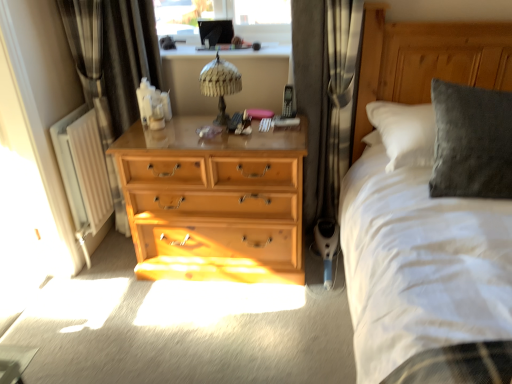
Image resolution: width=512 pixels, height=384 pixels. Describe the element at coordinates (323, 94) in the screenshot. I see `dark grey fabric curtain at center, marked as the 2th curtain in a left-to-right arrangement` at that location.

At what (x,y) coordinates should I click in order to perform the action: click on dark grey fabric curtain at center, marked as the 2th curtain in a left-to-right arrangement. Please return your answer as a coordinate pair (x, y). Looking at the image, I should click on (323, 94).

I want to click on black fabric curtain at left, which is the 2th curtain in right-to-left order, so click(112, 56).

You are a GUI agent. You are given a task and a screenshot of the screen. Output one action in this format:
    pyautogui.click(x=<x>, y=<y>)
    Task: Click on the woven fabric table lamp at center
    This screenshot has height=384, width=512.
    Given the screenshot: What is the action you would take?
    pyautogui.click(x=220, y=84)

You are a GUI agent. You are given a task and a screenshot of the screen. Output one action in this format:
    pyautogui.click(x=<x>, y=<y>)
    Task: Click on the radiator below the black fabric curtain at left, which is the 2th curtain in right-to-left order (from a real-world perspective)
    
    Given the screenshot: What is the action you would take?
    pyautogui.click(x=83, y=169)

Which is less distant, [78,12] or [58,145]?

The point [78,12] is closer to the camera.

Does black fabric curtain at left, placed as the first curtain when sorted from left to right, come behind white painted metal radiator at left?

No.

Who is taller, black fabric curtain at left, placed as the first curtain when sorted from left to right, or light wood dresser at center?

With more height is black fabric curtain at left, placed as the first curtain when sorted from left to right.

Which object is positioned more to the left, black fabric curtain at left, which is the 2th curtain in right-to-left order, or light wood dresser at center?

Positioned to the left is black fabric curtain at left, which is the 2th curtain in right-to-left order.

This screenshot has width=512, height=384. Identify the location of curtain that is the 2nd one above the light wood dresser at center (from a real-world perspective). (112, 56).

Based on their sizes in the image, would you say black fabric curtain at left, placed as the first curtain when sorted from left to right, is bigger or smaller than light wood dresser at center?

Clearly, black fabric curtain at left, placed as the first curtain when sorted from left to right, is smaller in size than light wood dresser at center.

Which of these two, woven fabric table lamp at center or light wood dresser at center, stands shorter?

woven fabric table lamp at center.

Which point is more distant from viewer, (209,68) or (270,191)?

The point (209,68) is farther.

This screenshot has height=384, width=512. What are the coordinates of `chest of drawers that appears on the left of woven fabric table lamp at center` in the screenshot? It's located at (213, 202).

From a real-world perspective, which is physically above, woven fabric table lamp at center or light wood dresser at center?

In real-world perspective, woven fabric table lamp at center is above.

Is black fabric curtain at left, which is the 2th curtain in right-to-left order, inside dark grey fabric curtain at center, marked as the 2th curtain in a left-to-right arrangement?

No, black fabric curtain at left, which is the 2th curtain in right-to-left order, is not inside dark grey fabric curtain at center, marked as the 2th curtain in a left-to-right arrangement.

Is dark grey fabric curtain at center, placed as the first curtain when sorted from right to left, positioned with its back to black fabric curtain at left, which is the 2th curtain in right-to-left order?

No, black fabric curtain at left, which is the 2th curtain in right-to-left order, is not at the back of dark grey fabric curtain at center, placed as the first curtain when sorted from right to left.

Can you confirm if dark grey fabric curtain at center, marked as the 2th curtain in a left-to-right arrangement, is wider than black fabric curtain at left, placed as the first curtain when sorted from left to right?

Yes, dark grey fabric curtain at center, marked as the 2th curtain in a left-to-right arrangement, is wider than black fabric curtain at left, placed as the first curtain when sorted from left to right.

Looking at this image, from the image's perspective, between light wood dresser at center and woven fabric table lamp at center, which one is located above?

woven fabric table lamp at center is shown above in the image.

What's the angular difference between light wood dresser at center and woven fabric table lamp at center's facing directions?

light wood dresser at center and woven fabric table lamp at center are facing 2.79 degrees away from each other.

From their relative heights in the image, would you say light wood dresser at center is taller or shorter than woven fabric table lamp at center?

light wood dresser at center is taller than woven fabric table lamp at center.

Where is `radiator on the left of dark grey fabric curtain at center, placed as the first curtain when sorted from right to left`? The image size is (512, 384). radiator on the left of dark grey fabric curtain at center, placed as the first curtain when sorted from right to left is located at coordinates (83, 169).

Is dark grey fabric curtain at center, placed as the first curtain when sorted from right to left, looking in the opposite direction of white painted metal radiator at left?

dark grey fabric curtain at center, placed as the first curtain when sorted from right to left, is not turned away from white painted metal radiator at left.

How different are the orientations of dark grey fabric curtain at center, placed as the first curtain when sorted from right to left, and white painted metal radiator at left in degrees?

There is a 88.6-degree angle between the facing directions of dark grey fabric curtain at center, placed as the first curtain when sorted from right to left, and white painted metal radiator at left.

Looking at this image, can you confirm if dark grey fabric curtain at center, placed as the first curtain when sorted from right to left, is thinner than white painted metal radiator at left?

No, dark grey fabric curtain at center, placed as the first curtain when sorted from right to left, is not thinner than white painted metal radiator at left.

Which of these two, black fabric curtain at left, placed as the first curtain when sorted from left to right, or woven fabric table lamp at center, is thinner?

black fabric curtain at left, placed as the first curtain when sorted from left to right.

Between black fabric curtain at left, placed as the first curtain when sorted from left to right, and woven fabric table lamp at center, which one has less height?

With less height is woven fabric table lamp at center.

Does black fabric curtain at left, which is the 2th curtain in right-to-left order, have a smaller size compared to woven fabric table lamp at center?

Incorrect, black fabric curtain at left, which is the 2th curtain in right-to-left order, is not smaller in size than woven fabric table lamp at center.

Is point (74, 4) closer or farther from the camera than point (222, 125)?

Clearly, point (74, 4) is more distant from the camera than point (222, 125).

There is a white painted metal radiator at left. In order to click on the 1st curtain above it (from the image's perspective) in this screenshot , I will do `click(112, 56)`.

I want to click on curtain that is the 2nd one when counting backward from the light wood dresser at center, so click(x=112, y=56).

When comparing their distances from white painted metal radiator at left, does black fabric curtain at left, which is the 2th curtain in right-to-left order, or light wood dresser at center seem closer?

The object closer to white painted metal radiator at left is black fabric curtain at left, which is the 2th curtain in right-to-left order.

Estimate the real-world distances between objects in this image. Which object is further from dark grey fabric curtain at center, placed as the first curtain when sorted from right to left, light wood dresser at center or black fabric curtain at left, which is the 2th curtain in right-to-left order?

black fabric curtain at left, which is the 2th curtain in right-to-left order, is positioned further to the anchor dark grey fabric curtain at center, placed as the first curtain when sorted from right to left.

When comparing their distances from woven fabric table lamp at center, does light wood dresser at center or black fabric curtain at left, placed as the first curtain when sorted from left to right, seem closer?

light wood dresser at center is positioned closer to the anchor woven fabric table lamp at center.

When comparing their distances from dark grey fabric curtain at center, marked as the 2th curtain in a left-to-right arrangement, does woven fabric table lamp at center or light wood dresser at center seem closer?

woven fabric table lamp at center is positioned closer to the anchor dark grey fabric curtain at center, marked as the 2th curtain in a left-to-right arrangement.

From the image, which object appears to be nearer to woven fabric table lamp at center, dark grey fabric curtain at center, marked as the 2th curtain in a left-to-right arrangement, or white painted metal radiator at left?

dark grey fabric curtain at center, marked as the 2th curtain in a left-to-right arrangement.

Which object lies further to the anchor point black fabric curtain at left, which is the 2th curtain in right-to-left order, dark grey fabric curtain at center, placed as the first curtain when sorted from right to left, or light wood dresser at center?

Among the two, dark grey fabric curtain at center, placed as the first curtain when sorted from right to left, is located further to black fabric curtain at left, which is the 2th curtain in right-to-left order.

Considering their positions, is black fabric curtain at left, which is the 2th curtain in right-to-left order, positioned further to white painted metal radiator at left than woven fabric table lamp at center?

woven fabric table lamp at center is further to white painted metal radiator at left.

Which object lies nearer to the anchor point white painted metal radiator at left, light wood dresser at center or black fabric curtain at left, which is the 2th curtain in right-to-left order?

black fabric curtain at left, which is the 2th curtain in right-to-left order, is closer to white painted metal radiator at left.

Where is `curtain between white painted metal radiator at left and woven fabric table lamp at center in the horizontal direction`? The height and width of the screenshot is (384, 512). curtain between white painted metal radiator at left and woven fabric table lamp at center in the horizontal direction is located at coordinates (112, 56).

This screenshot has height=384, width=512. What are the coordinates of `table lamp between black fabric curtain at left, which is the 2th curtain in right-to-left order, and dark grey fabric curtain at center, marked as the 2th curtain in a left-to-right arrangement` in the screenshot? It's located at (220, 84).

Where is `curtain located between white painted metal radiator at left and dark grey fabric curtain at center, marked as the 2th curtain in a left-to-right arrangement, in the left-right direction`? The height and width of the screenshot is (384, 512). curtain located between white painted metal radiator at left and dark grey fabric curtain at center, marked as the 2th curtain in a left-to-right arrangement, in the left-right direction is located at coordinates (112, 56).

This screenshot has height=384, width=512. I want to click on table lamp between light wood dresser at center and dark grey fabric curtain at center, marked as the 2th curtain in a left-to-right arrangement, from left to right, so click(220, 84).